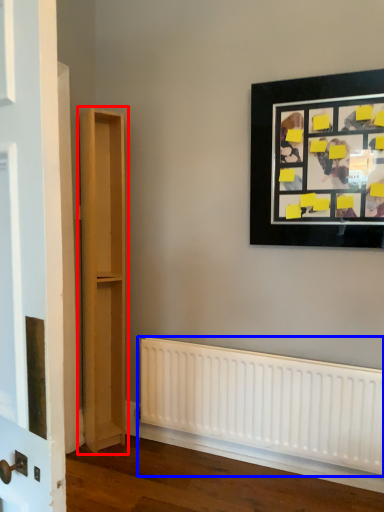
Question: Which object is further to the camera taking this photo, bookshelf (highlighted by a red box) or radiator (highlighted by a blue box)?

Choices:
 (A) bookshelf
 (B) radiator

Answer: (A)